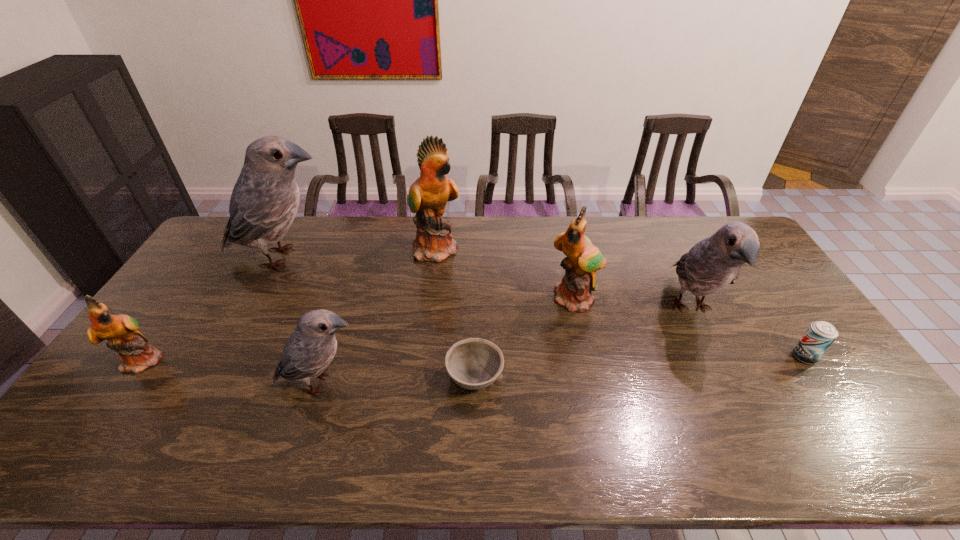
I want to click on free space between the biggest gray parrot and the second biggest green parrot, so click(x=429, y=279).

Where is `vacant space in between the third object from right to left and the seventh object from left to right`? This screenshot has width=960, height=540. vacant space in between the third object from right to left and the seventh object from left to right is located at coordinates (633, 304).

This screenshot has width=960, height=540. What are the coordinates of `unoccupied area between the rightmost gray parrot and the rightmost object` in the screenshot? It's located at (748, 333).

Identify the location of blank region between the farthest gray parrot and the second parrot from right to left. (429, 279).

Identify the location of vacant point located between the second object from right to left and the seventh tallest object. (748, 333).

This screenshot has height=540, width=960. In order to click on free spot between the farthest gray parrot and the rightmost gray parrot in this screenshot , I will do `click(488, 284)`.

You are a GUI agent. You are given a task and a screenshot of the screen. Output one action in this format:
    pyautogui.click(x=<x>, y=<y>)
    Task: Click on the vacant area that lies between the shortest object and the second green parrot from left to right
    The height and width of the screenshot is (540, 960).
    Given the screenshot: What is the action you would take?
    pyautogui.click(x=456, y=313)

Where is `object that is the fourth closest to the biggest gray parrot`? The image size is (960, 540). object that is the fourth closest to the biggest gray parrot is located at coordinates (474, 363).

Identify the location of object that is the nearest to the beer can. coord(712,264).

Locate an element on the screen. parrot that is the fifth closest to the farthest gray parrot is located at coordinates (712, 264).